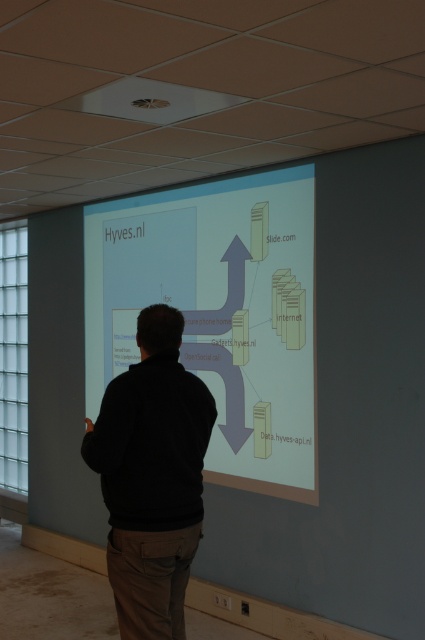
Locate an element on the screen. The height and width of the screenshot is (640, 425). matte white projector screen at center is located at coordinates (218, 312).